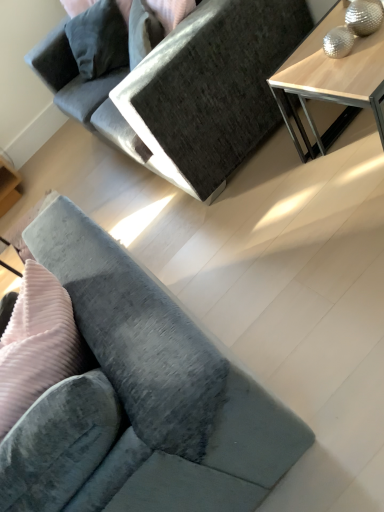
Question: From their relative heights in the image, would you say light wood table at upper right is taller or shorter than velvet grey couch at lower left, marked as the 2th studio couch in a top-to-bottom arrangement?

Choices:
 (A) short
 (B) tall

Answer: (A)

Question: Considering their positions, is light wood table at upper right located in front of or behind velvet grey couch at lower left, which is the first studio couch in bottom-to-top order?

Choices:
 (A) behind
 (B) front

Answer: (A)

Question: Which is farther from the light wood table at upper right?

Choices:
 (A) velvet gray couch at center, the 2th studio couch from the bottom
 (B) velvet grey couch at lower left, which is the first studio couch in bottom-to-top order

Answer: (B)

Question: Estimate the real-world distances between objects in this image. Which object is closer to the velvet gray couch at center, the 2th studio couch from the bottom?

Choices:
 (A) light wood table at upper right
 (B) velvet grey couch at lower left, which is the first studio couch in bottom-to-top order

Answer: (A)